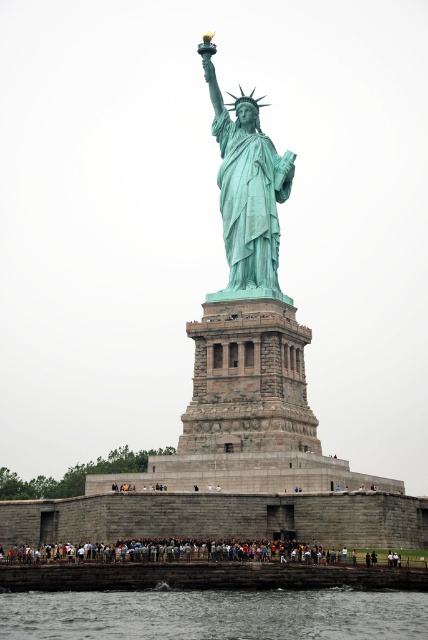
You are a tourist standing on the dock looking at the Statue of Liberty. You see the clear water at lower center and the green patina statue at center. Which object is positioned to the left of the other?

The clear water at lower center is to the left of the green patina statue at center according to the description.

You are a photographer planning to capture the Statue of Liberty and the crowd in front of it. You want to ensure both the statue and the crowd are fully visible in your shot. Given that your camera frame can accommodate a maximum width of 10 meters, will the combined width of the green patina statue at center and dark gray concrete crowd at lower center fit within this limit?

The green patina statue at center is narrower than the dark gray concrete crowd at lower center. However, since the exact widths aren